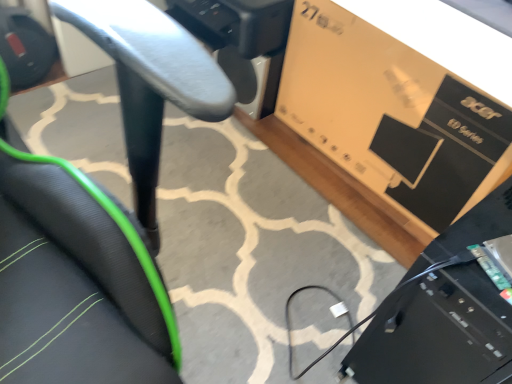
Question: Is matte brown cardboard box at upper right outside black mesh chair at center?

Choices:
 (A) no
 (B) yes

Answer: (B)

Question: Is matte brown cardboard box at upper right wider than black mesh chair at center?

Choices:
 (A) yes
 (B) no

Answer: (B)

Question: Is black mesh chair at center located within matte brown cardboard box at upper right?

Choices:
 (A) yes
 (B) no

Answer: (B)

Question: Is matte brown cardboard box at upper right positioned behind black mesh chair at center?

Choices:
 (A) yes
 (B) no

Answer: (A)

Question: Does matte brown cardboard box at upper right appear on the right side of black mesh chair at center?

Choices:
 (A) yes
 (B) no

Answer: (A)

Question: Considering the positions of point (49, 364) and point (449, 299), is point (49, 364) closer or farther from the camera than point (449, 299)?

Choices:
 (A) closer
 (B) farther

Answer: (A)

Question: Based on their sizes in the image, would you say black mesh chair at center is bigger or smaller than black plastic computer at lower right?

Choices:
 (A) big
 (B) small

Answer: (A)

Question: From a real-world perspective, is black mesh chair at center above or below black plastic computer at lower right?

Choices:
 (A) above
 (B) below

Answer: (B)

Question: Considering the relative positions of black mesh chair at center and black plastic computer at lower right in the image provided, is black mesh chair at center to the left or to the right of black plastic computer at lower right?

Choices:
 (A) right
 (B) left

Answer: (B)

Question: From the image's perspective, is matte brown cardboard box at upper right located above or below black plastic computer at lower right?

Choices:
 (A) above
 (B) below

Answer: (A)

Question: Considering the positions of matte brown cardboard box at upper right and black plastic computer at lower right in the image, is matte brown cardboard box at upper right taller or shorter than black plastic computer at lower right?

Choices:
 (A) short
 (B) tall

Answer: (A)

Question: Choose the correct answer: Is matte brown cardboard box at upper right inside black plastic computer at lower right or outside it?

Choices:
 (A) outside
 (B) inside

Answer: (A)

Question: In the image, is matte brown cardboard box at upper right on the left side or the right side of black plastic computer at lower right?

Choices:
 (A) right
 (B) left

Answer: (B)

Question: From a real-world perspective, relative to matte brown cardboard box at upper right, is black plastic computer at lower right vertically above or below?

Choices:
 (A) above
 (B) below

Answer: (A)

Question: From the image's perspective, is black plastic computer at lower right positioned above or below matte brown cardboard box at upper right?

Choices:
 (A) below
 (B) above

Answer: (A)